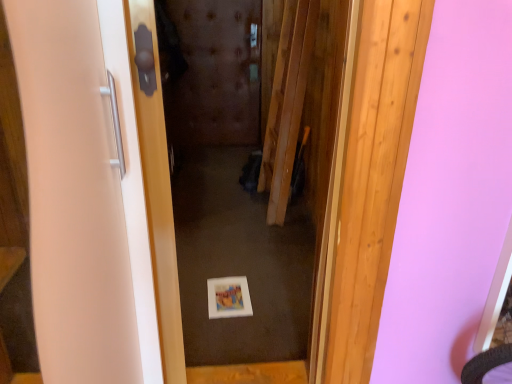
Image resolution: width=512 pixels, height=384 pixels. What are the coordinates of `white glossy door at center, the 2th door positioned from the left` in the screenshot? It's located at [225, 230].

What do you see at coordinates (225, 230) in the screenshot?
I see `white glossy door at center, the first door positioned from the right` at bounding box center [225, 230].

What is the approximate height of white glossy door at center, the first door positioned from the right?

white glossy door at center, the first door positioned from the right, is 4.19 feet in height.

The width and height of the screenshot is (512, 384). What do you see at coordinates (99, 192) in the screenshot?
I see `white glossy door handle at left, positioned as the second door in right-to-left order` at bounding box center [99, 192].

Find the location of `white glossy door handle at left, positioned as the second door in right-to-left order`. white glossy door handle at left, positioned as the second door in right-to-left order is located at coordinates (99, 192).

Measure the distance between white glossy door handle at left, positioned as the second door in right-to-left order, and camera.

white glossy door handle at left, positioned as the second door in right-to-left order, is 20.15 inches away from camera.

You are a GUI agent. You are given a task and a screenshot of the screen. Output one action in this format:
    pyautogui.click(x=<x>, y=<y>)
    Task: Click on the white glossy door at center, the first door positioned from the right
    
    Given the screenshot: What is the action you would take?
    pyautogui.click(x=225, y=230)

Which is more to the right, white glossy door at center, the 2th door positioned from the left, or white glossy door handle at left, positioned as the second door in right-to-left order?

white glossy door at center, the 2th door positioned from the left, is more to the right.

Relative to white glossy door handle at left, positioned as the second door in right-to-left order, is white glossy door at center, the first door positioned from the right, in front or behind?

Clearly, white glossy door at center, the first door positioned from the right, is behind white glossy door handle at left, positioned as the second door in right-to-left order.

Considering the points (216, 378) and (165, 216), which point is behind, point (216, 378) or point (165, 216)?

Positioned behind is point (216, 378).

From the image's perspective, which one is positioned lower, white glossy door at center, the 2th door positioned from the left, or white glossy door handle at left, placed as the 1th door when sorted from left to right?

white glossy door at center, the 2th door positioned from the left, is shown below in the image.

From the picture: From a real-world perspective, is white glossy door at center, the 2th door positioned from the left, under white glossy door handle at left, placed as the 1th door when sorted from left to right?

Yes, from a real-world perspective, white glossy door at center, the 2th door positioned from the left, is under white glossy door handle at left, placed as the 1th door when sorted from left to right.

Based on the photo, considering the relative sizes of white glossy door at center, the first door positioned from the right, and white glossy door handle at left, positioned as the second door in right-to-left order, in the image provided, is white glossy door at center, the first door positioned from the right, thinner than white glossy door handle at left, positioned as the second door in right-to-left order,?

Indeed, white glossy door at center, the first door positioned from the right, has a lesser width compared to white glossy door handle at left, positioned as the second door in right-to-left order.

Which of these two, white glossy door at center, the first door positioned from the right, or white glossy door handle at left, positioned as the second door in right-to-left order, stands taller?

With more height is white glossy door at center, the first door positioned from the right.

Consider the image. Based on their sizes in the image, would you say white glossy door at center, the first door positioned from the right, is bigger or smaller than white glossy door handle at left, placed as the 1th door when sorted from left to right?

white glossy door at center, the first door positioned from the right, is bigger than white glossy door handle at left, placed as the 1th door when sorted from left to right.

Is white glossy door at center, the 2th door positioned from the left, not within white glossy door handle at left, placed as the 1th door when sorted from left to right?

No.

Are white glossy door at center, the 2th door positioned from the left, and white glossy door handle at left, placed as the 1th door when sorted from left to right, beside each other?

No, white glossy door at center, the 2th door positioned from the left, is not beside white glossy door handle at left, placed as the 1th door when sorted from left to right.

Could you tell me if white glossy door at center, the first door positioned from the right, is turned towards white glossy door handle at left, positioned as the second door in right-to-left order?

Yes, white glossy door at center, the first door positioned from the right, is aimed at white glossy door handle at left, positioned as the second door in right-to-left order.

Can you tell me how much white glossy door at center, the 2th door positioned from the left, and white glossy door handle at left, positioned as the second door in right-to-left order, differ in facing direction?

The angle between the facing direction of white glossy door at center, the 2th door positioned from the left, and the facing direction of white glossy door handle at left, positioned as the second door in right-to-left order, is 0.179 degrees.

In order to click on door located behind the white glossy door handle at left, positioned as the second door in right-to-left order in this screenshot , I will do `click(225, 230)`.

Considering the positions of objects white glossy door handle at left, positioned as the second door in right-to-left order, and white glossy door at center, the 2th door positioned from the left, in the image provided, who is more to the right, white glossy door handle at left, positioned as the second door in right-to-left order, or white glossy door at center, the 2th door positioned from the left,?

white glossy door at center, the 2th door positioned from the left, is more to the right.

Is white glossy door handle at left, placed as the 1th door when sorted from left to right, further to the viewer compared to white glossy door at center, the first door positioned from the right?

No, white glossy door handle at left, placed as the 1th door when sorted from left to right, is closer to the viewer.

Considering the points (105, 225) and (256, 283), which point is behind, point (105, 225) or point (256, 283)?

The point (256, 283) is more distant.

From the image's perspective, which is below, white glossy door handle at left, positioned as the second door in right-to-left order, or white glossy door at center, the 2th door positioned from the left?

white glossy door at center, the 2th door positioned from the left, appears lower in the image.

From a real-world perspective, is white glossy door handle at left, positioned as the second door in right-to-left order, on top of white glossy door at center, the 2th door positioned from the left?

Yes, from a real-world perspective, white glossy door handle at left, positioned as the second door in right-to-left order, is on top of white glossy door at center, the 2th door positioned from the left.

Does white glossy door handle at left, placed as the 1th door when sorted from left to right, have a greater width compared to white glossy door at center, the 2th door positioned from the left?

Yes.

From their relative heights in the image, would you say white glossy door handle at left, placed as the 1th door when sorted from left to right, is taller or shorter than white glossy door at center, the first door positioned from the right?

Considering their sizes, white glossy door handle at left, placed as the 1th door when sorted from left to right, has less height than white glossy door at center, the first door positioned from the right.

Which of these two, white glossy door handle at left, placed as the 1th door when sorted from left to right, or white glossy door at center, the first door positioned from the right, is bigger?

white glossy door at center, the first door positioned from the right.

Is white glossy door handle at left, placed as the 1th door when sorted from left to right, inside or outside of white glossy door at center, the first door positioned from the right?

white glossy door handle at left, placed as the 1th door when sorted from left to right, is inside white glossy door at center, the first door positioned from the right.

Is white glossy door handle at left, placed as the 1th door when sorted from left to right, not close to white glossy door at center, the 2th door positioned from the left?

white glossy door handle at left, placed as the 1th door when sorted from left to right, is actually quite close to white glossy door at center, the 2th door positioned from the left.

Is white glossy door handle at left, positioned as the second door in right-to-left order, positioned with its back to white glossy door at center, the 2th door positioned from the left?

Yes, white glossy door at center, the 2th door positioned from the left, is at the back of white glossy door handle at left, positioned as the second door in right-to-left order.

Based on the photo, can you tell me how much white glossy door handle at left, positioned as the second door in right-to-left order, and white glossy door at center, the 2th door positioned from the left, differ in facing direction?

white glossy door handle at left, positioned as the second door in right-to-left order, and white glossy door at center, the 2th door positioned from the left, are facing 0.179 degrees away from each other.

Image resolution: width=512 pixels, height=384 pixels. In order to click on door directly beneath the white glossy door handle at left, positioned as the second door in right-to-left order (from a real-world perspective) in this screenshot , I will do `click(225, 230)`.

This screenshot has height=384, width=512. In order to click on door to the right of white glossy door handle at left, placed as the 1th door when sorted from left to right in this screenshot , I will do `click(225, 230)`.

The width and height of the screenshot is (512, 384). I want to click on door that appears behind the white glossy door handle at left, placed as the 1th door when sorted from left to right, so click(x=225, y=230).